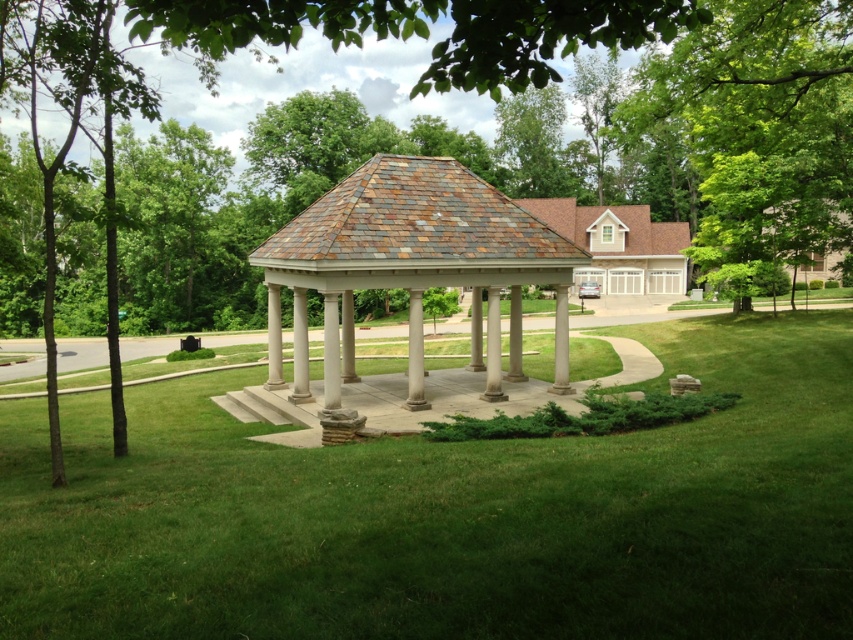
You are planning to set up a picnic table in the gazebo area. The picnic table requires a space that is at least 3 meters wide. Based on the scene description, can you determine if the white stone gazebo at center or the rustic shingles gazebo at center provides enough width for the picnic table?

The white stone gazebo at center might be wider than rustic shingles gazebo at center. However, the exact width required for the picnic table is 3 meters. Since the description only states that the white stone gazebo at center might be wider than the rustic shingles gazebo at center, but does not provide specific measurements, it is unclear if either gazebo meets the 3 meter width requirement. Further information would be needed to make a definitive determination.

You are standing in front of the gazebo and notice two points marked on the roof. The first point is at coordinates point (538, 227) and the second is at point (550, 200). Which point is closer to you?

Point (538, 227) is closer to the viewer than point (550, 200).